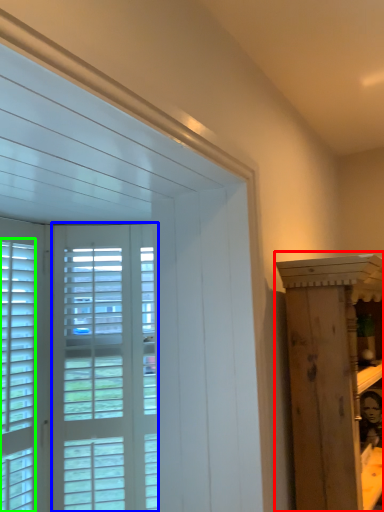
Question: Estimate the real-world distances between objects in this image. Which object is farther from furniture (highlighted by a red box), screen door (highlighted by a blue box) or window (highlighted by a green box)?

Choices:
 (A) screen door
 (B) window

Answer: (B)